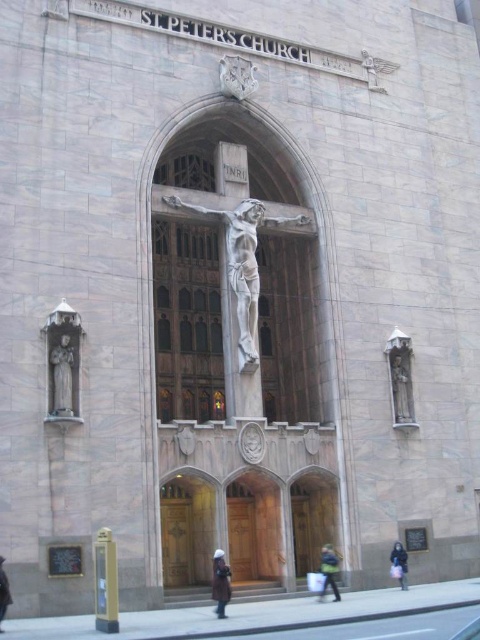
You are standing in front of St. Peter s Church and notice two statues on either side of the main entrance. The polished stone angel at right and the polished bronze statue at left. Which one appears closer to you?

The polished stone angel at right appears closer to you because it is further to the viewer than the polished bronze statue at left.

You are standing in front of St. Peter s Church and want to take a photo of the polished bronze crucifix at center and the polished stone statue at right. Which object is closer to you?

A: The polished bronze crucifix at center is closer to you than the polished stone statue at right.

You are an art student analyzing the symmetry of St. Peter Church. You notice the polished stone angel at right and the polished bronze statue at left. Which of these two statues has a smaller width?

The polished stone angel at right is thinner than the polished bronze statue at left, so the polished stone angel at right has a smaller width.